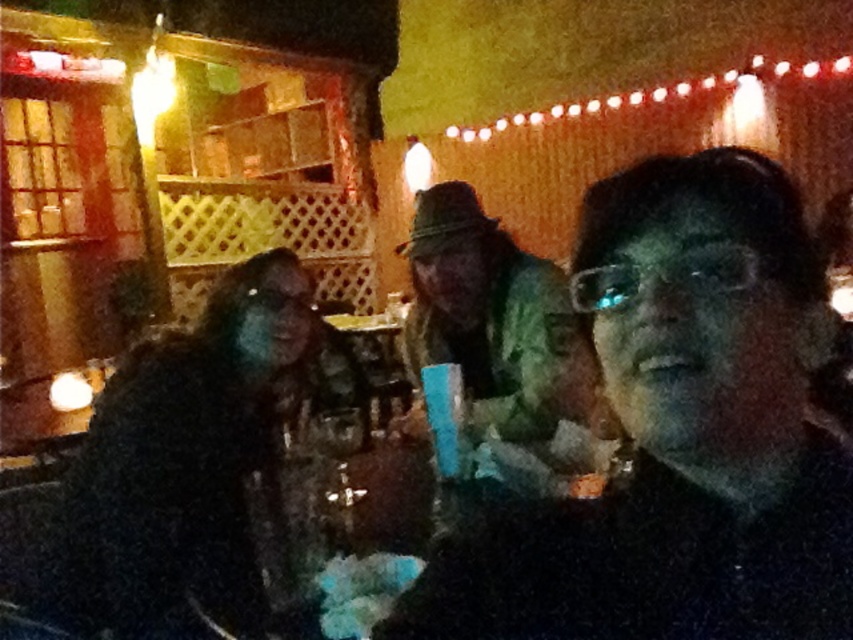
Question: Does black fuzzy coat at left appear on the right side of green camouflage jacket at center?

Choices:
 (A) no
 (B) yes

Answer: (A)

Question: Can you confirm if matte black glasses at center is positioned to the right of green camouflage jacket at center?

Choices:
 (A) yes
 (B) no

Answer: (B)

Question: Which object is the closest to the matte black glasses at center?

Choices:
 (A) black fuzzy coat at left
 (B) green camouflage jacket at center

Answer: (B)

Question: Does matte black glasses at center have a larger size compared to black fuzzy coat at left?

Choices:
 (A) yes
 (B) no

Answer: (B)

Question: Which point appears farthest from the camera in this image?

Choices:
 (A) (170, 556)
 (B) (451, 317)
 (C) (692, 292)

Answer: (B)

Question: Which point is closer to the camera taking this photo?

Choices:
 (A) (579, 346)
 (B) (132, 481)

Answer: (B)